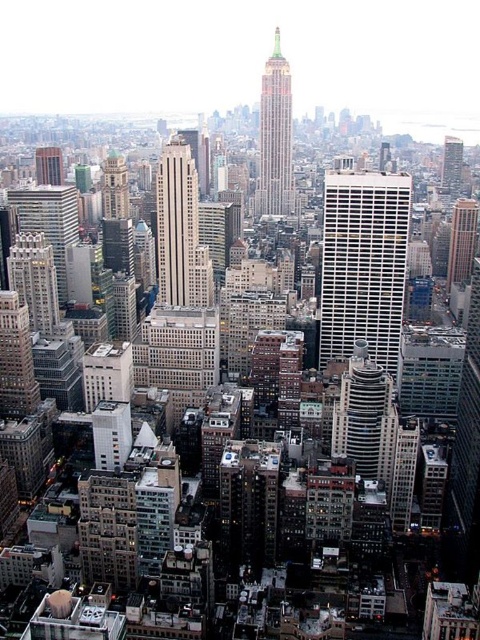
Question: Does white textured building at center lie in front of black glass tower at center-right?

Choices:
 (A) no
 (B) yes

Answer: (B)

Question: Which of the following is the closest to the observer?

Choices:
 (A) (450, 152)
 (B) (49, 177)

Answer: (B)

Question: Which of the following is the farthest from the observer?

Choices:
 (A) (45, 170)
 (B) (324, 355)

Answer: (A)

Question: Is matte pink building at center thinner than matte gray skyscraper at left?

Choices:
 (A) yes
 (B) no

Answer: (A)

Question: Among these points, which one is farthest from the camera?

Choices:
 (A) (468, 266)
 (B) (367, 333)

Answer: (A)

Question: Is the position of white textured building at center more distant than that of matte gray skyscraper at left?

Choices:
 (A) no
 (B) yes

Answer: (A)